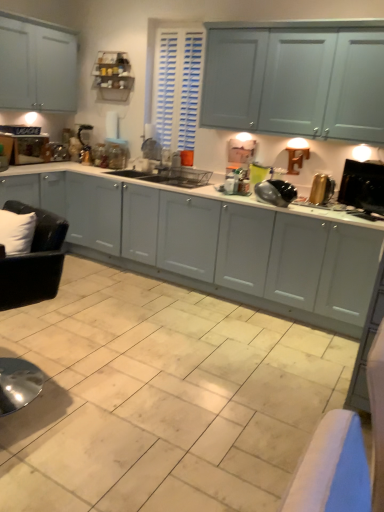
The width and height of the screenshot is (384, 512). I want to click on free point above beige ceramic tile at center (from a real-world perspective), so 140,371.